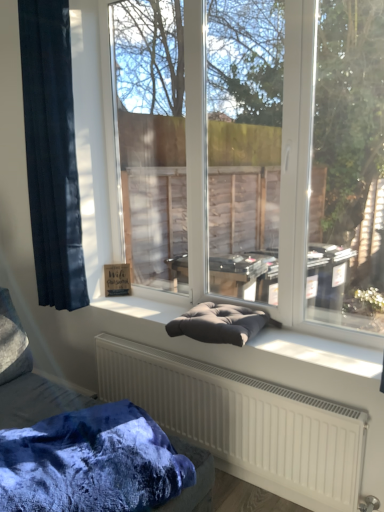
You are a GUI agent. You are given a task and a screenshot of the screen. Output one action in this format:
    pyautogui.click(x=<x>, y=<y>)
    Task: Click on the empty space that is ontop of dark gray cushion at center
    This screenshot has width=384, height=512.
    Given the screenshot: What is the action you would take?
    pyautogui.click(x=255, y=332)